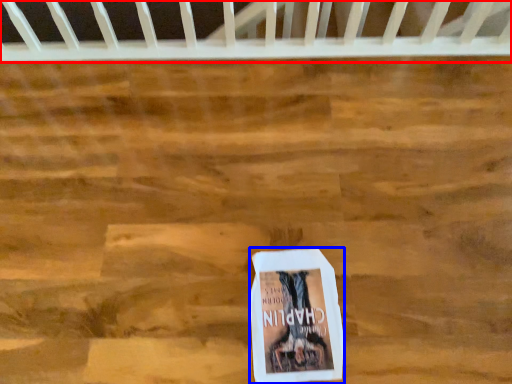
Question: Which point is further to the camera, infant bed (highlighted by a red box) or book (highlighted by a blue box)?

Choices:
 (A) infant bed
 (B) book

Answer: (A)